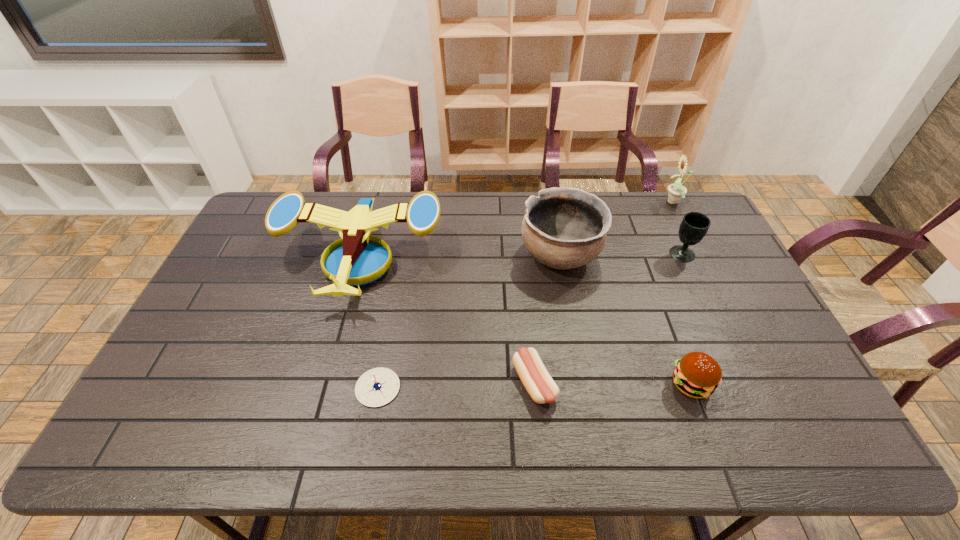
The height and width of the screenshot is (540, 960). Find the location of `object that is the third closest to the chalice`. object that is the third closest to the chalice is located at coordinates (697, 375).

The width and height of the screenshot is (960, 540). I want to click on free region that satisfies the following two spatial constraints: 1. at the cockpit of the sausage; 2. on the left side of the drone, so click(325, 383).

Find the location of a particular element. The image size is (960, 540). free region that satisfies the following two spatial constraints: 1. at the cockpit of the hamburger; 2. on the right side of the drone is located at coordinates (325, 384).

What are the coordinates of `free location that satisfies the following two spatial constraints: 1. on the back side of the sausage; 2. on the left side of the chalice` in the screenshot? It's located at (522, 254).

At what (x,y) coordinates should I click in order to perform the action: click on free location that satisfies the following two spatial constraints: 1. at the cockpit of the third object from right to left; 2. on the right side of the drone. Please return your answer as a coordinate pair (x, y). The width and height of the screenshot is (960, 540). Looking at the image, I should click on point(325,384).